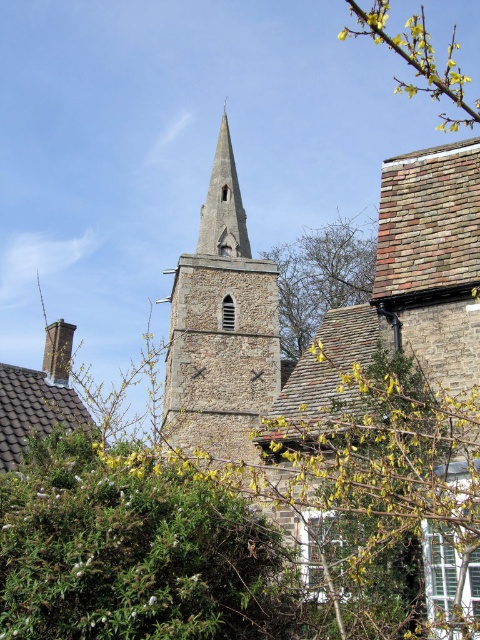
Does brown stone church tower at center have a greater width compared to green leafy tree at center?

No.

Does brown stone church tower at center have a lesser height compared to green leafy tree at center?

No, brown stone church tower at center is not shorter than green leafy tree at center.

Does point (227, 449) lie in front of point (367, 275)?

Yes, point (227, 449) is closer to viewer.

At what (x,y) coordinates should I click in order to perform the action: click on brown stone church tower at center. Please return your answer as a coordinate pair (x, y). This screenshot has width=480, height=640. Looking at the image, I should click on (220, 330).

Who is lower down, green leafy tree at center or smooth stone spire at center?

green leafy tree at center is lower down.

Which is above, green leafy tree at center or smooth stone spire at center?

smooth stone spire at center is above.

This screenshot has width=480, height=640. Identify the location of green leafy tree at center. (321, 276).

The width and height of the screenshot is (480, 640). What do you see at coordinates (321, 276) in the screenshot? I see `green leafy tree at center` at bounding box center [321, 276].

Does green leafy tree at center have a greater height compared to yellow flower at upper right?

No.

Who is more distant from viewer, (x=289, y=330) or (x=384, y=20)?

Point (x=289, y=330)

You are a GUI agent. You are given a task and a screenshot of the screen. Output one action in this format:
    pyautogui.click(x=<x>, y=<y>)
    Task: Click on the green leafy tree at center
    The height and width of the screenshot is (640, 480).
    Given the screenshot: What is the action you would take?
    pyautogui.click(x=321, y=276)